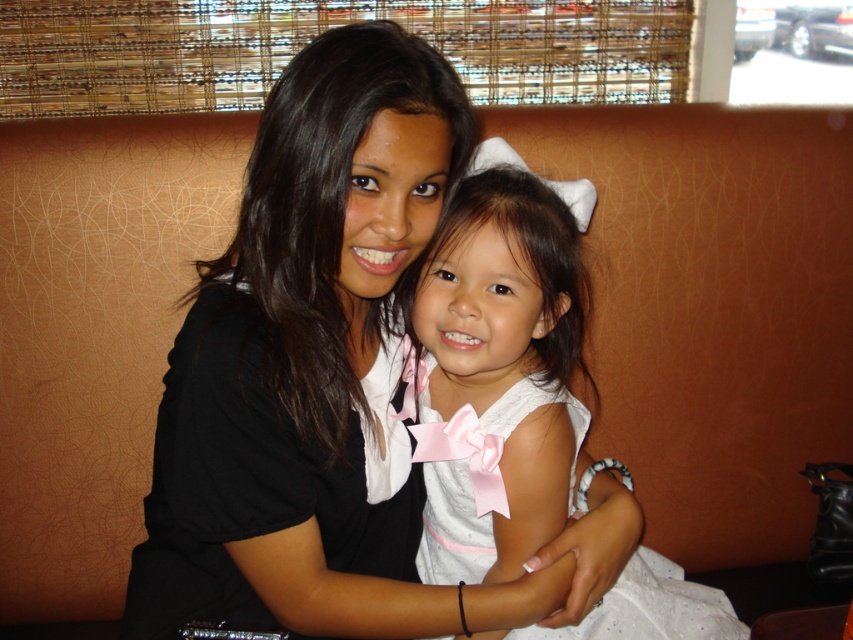
In the scene shown: Can you confirm if black matte shirt at center is positioned to the right of white satin dress at center?

In fact, black matte shirt at center is to the left of white satin dress at center.

Is black matte shirt at center below white satin dress at center?

No.

Does point (344, 368) come behind point (532, 312)?

No, it is not.

This screenshot has height=640, width=853. In order to click on black matte shirt at center in this screenshot , I will do `click(305, 362)`.